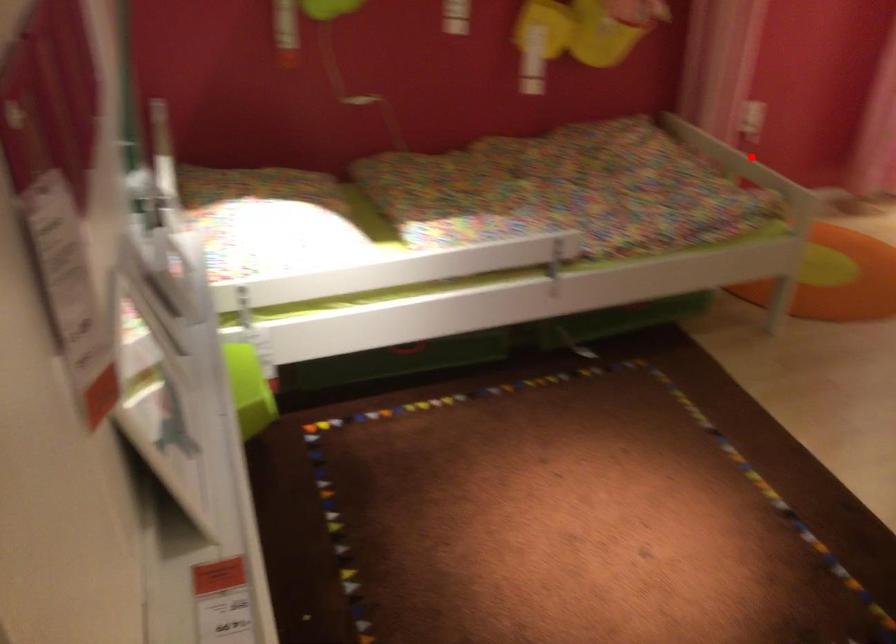
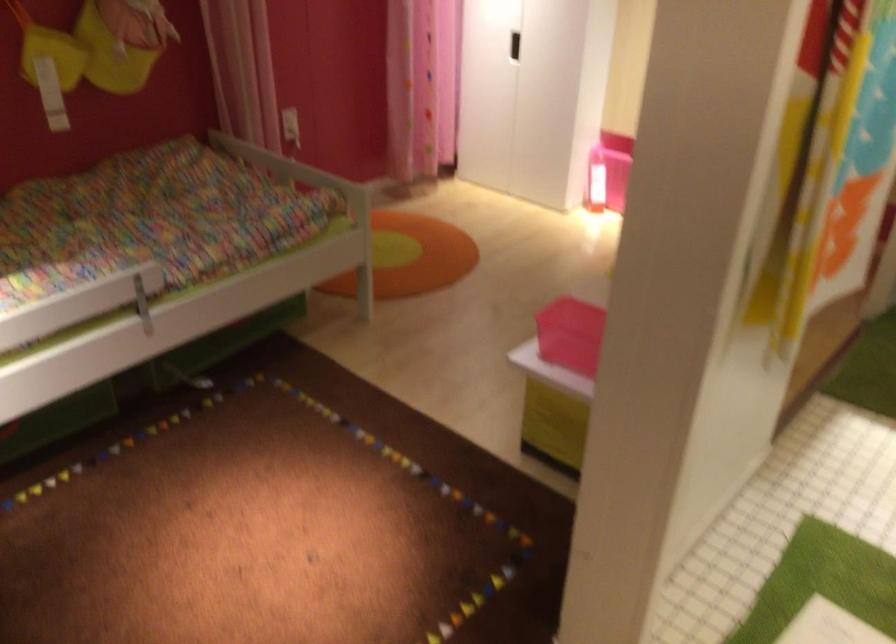
Question: A red point is marked in image1. In image2, is the corresponding 3D point closer to the camera or farther? Reply with the corresponding letter.

Choices:
 (A) The corresponding 3D point is closer.
 (B) The corresponding 3D point is farther.

Answer: (B)